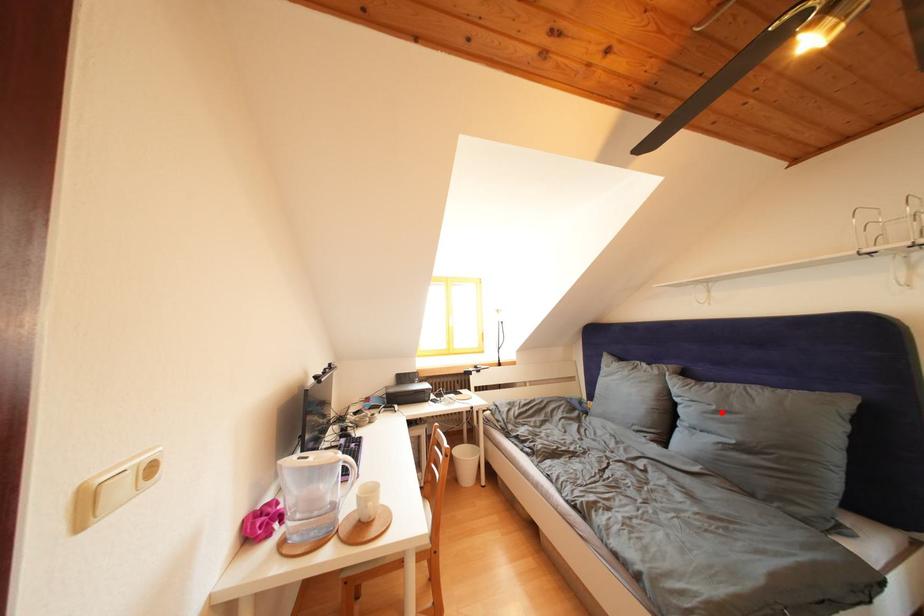
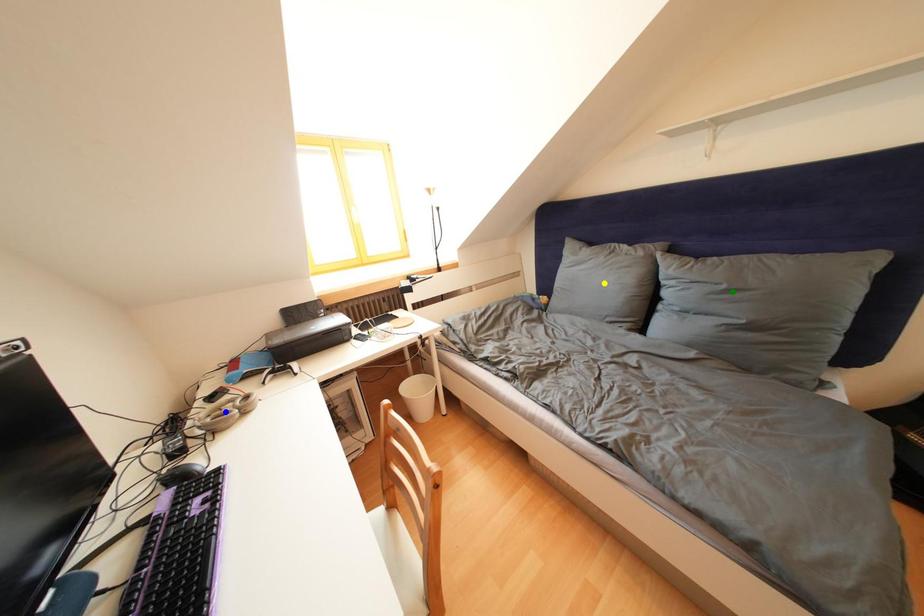
Question: I am providing you with two images of the same scene from different viewpoints. A red point is marked on the first image. You are given multiple points on the second image. Can you choose the point in image 2 that corresponds to the point in image 1?

Choices:
 (A) blue point
 (B) yellow point
 (C) green point

Answer: (C)